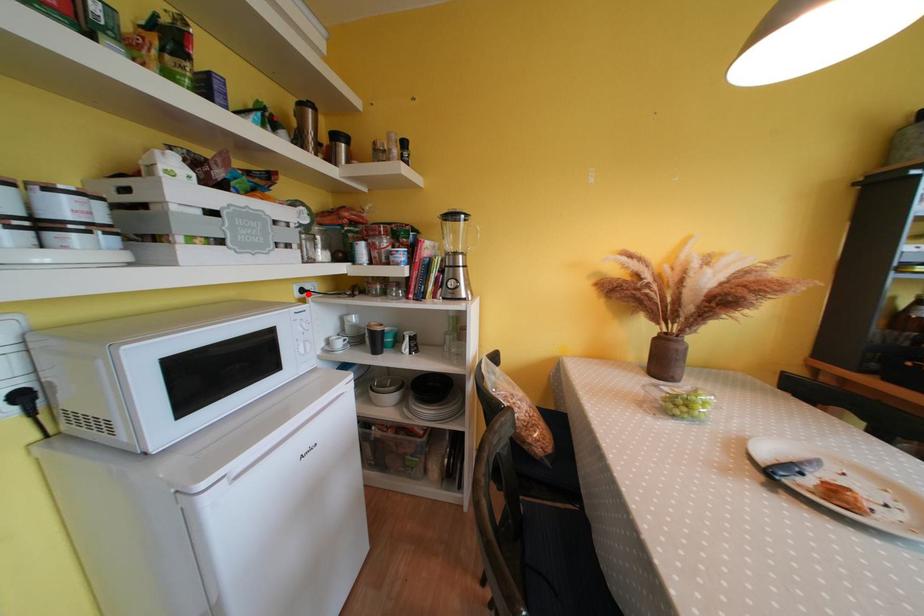
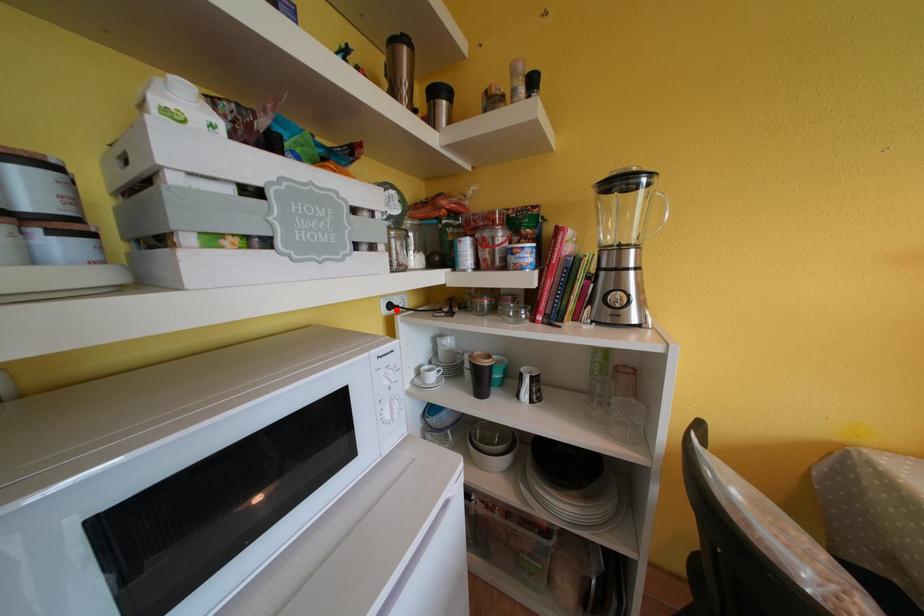
I am providing you with two images of the same scene from different viewpoints. A red point is marked on the first image and another point is marked on the second image. Are the points marked in image1 and image2 representing the same 3D position?

Yes